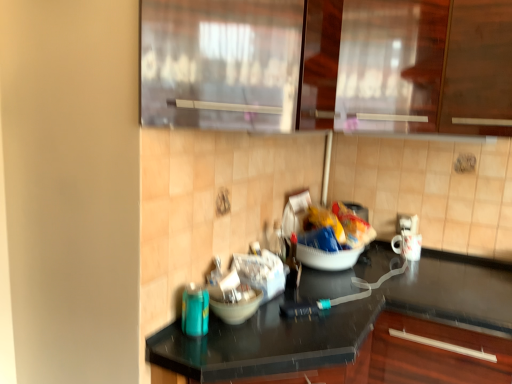
Question: From the image's perspective, is transparent glass cabinet at upper center, marked as the 2th glass door in a front-to-back arrangement, above or below yellow crinkled chips at center?

Choices:
 (A) below
 (B) above

Answer: (B)

Question: Would you say transparent glass cabinet at upper center, marked as the 2th glass door in a front-to-back arrangement, is to the left or to the right of yellow crinkled chips at center in the picture?

Choices:
 (A) left
 (B) right

Answer: (B)

Question: Which of these objects is positioned farthest from the transparent glass door at upper center, acting as the second glass door starting from the back?

Choices:
 (A) white glossy mug at right
 (B) matte white bowl at center
 (C) transparent glass cabinet at upper center, marked as the 2th glass door in a front-to-back arrangement
 (D) yellow crinkled chips at center
 (E) black glossy countertop at center

Answer: (A)

Question: Which object is positioned farthest from the yellow crinkled chips at center?

Choices:
 (A) white glossy mug at right
 (B) black glossy countertop at center
 (C) transparent glass cabinet at upper center, marked as the 2th glass door in a front-to-back arrangement
 (D) matte white bowl at center
 (E) transparent glass door at upper center, acting as the second glass door starting from the back

Answer: (E)